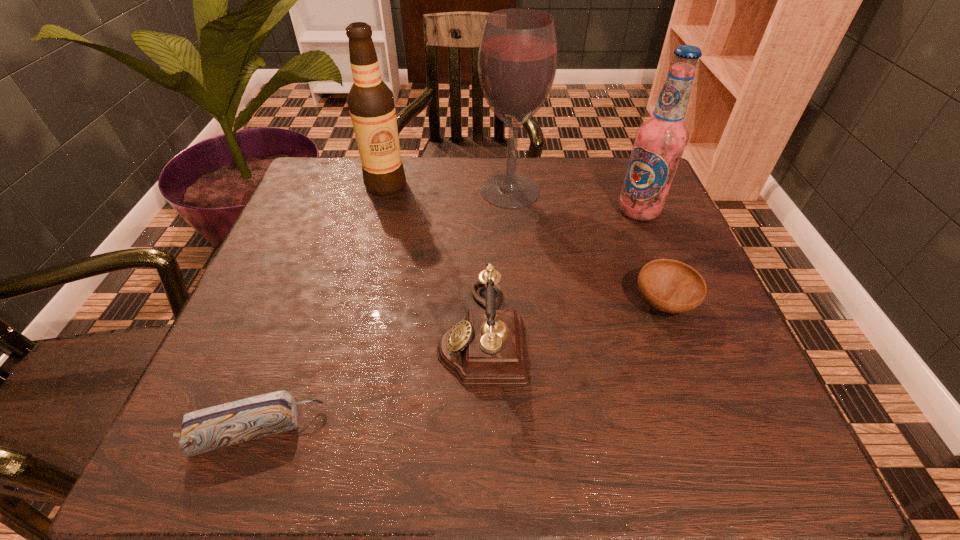
Identify the location of blank space at the far edge of the desktop. (367, 195).

Identify the location of free region at the near edge of the desktop. The height and width of the screenshot is (540, 960). (348, 434).

The height and width of the screenshot is (540, 960). What are the coordinates of `vacant space at the left edge of the desktop` in the screenshot? It's located at (238, 332).

I want to click on vacant region at the right edge of the desktop, so click(x=662, y=382).

In the image, there is a desktop. In order to click on vacant space at the far left corner in this screenshot , I will do `click(319, 199)`.

Locate an element on the screen. vacant space at the far right corner of the desktop is located at coordinates (596, 176).

In order to click on free space between the nearest object and the third shortest object in this screenshot , I will do `click(369, 381)`.

Where is `vacant space in between the nearest object and the leftmost alcohol`? Image resolution: width=960 pixels, height=540 pixels. vacant space in between the nearest object and the leftmost alcohol is located at coordinates point(322,308).

You are a GUI agent. You are given a task and a screenshot of the screen. Output one action in this format:
    pyautogui.click(x=<x>, y=<y>)
    Task: Click on the vacant area that lies between the rightmost alcohol and the bowl
    
    Given the screenshot: What is the action you would take?
    651,257

Identify the location of free space between the second alcohol from right to left and the pencil box. (383, 310).